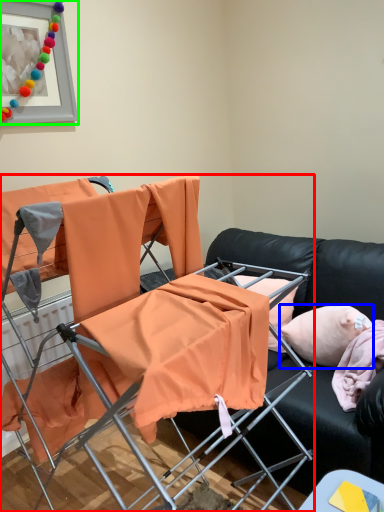
Question: Which is farther away from chair (highlighted by a red box)? pillow (highlighted by a blue box) or picture frame (highlighted by a green box)?

Choices:
 (A) pillow
 (B) picture frame

Answer: (B)